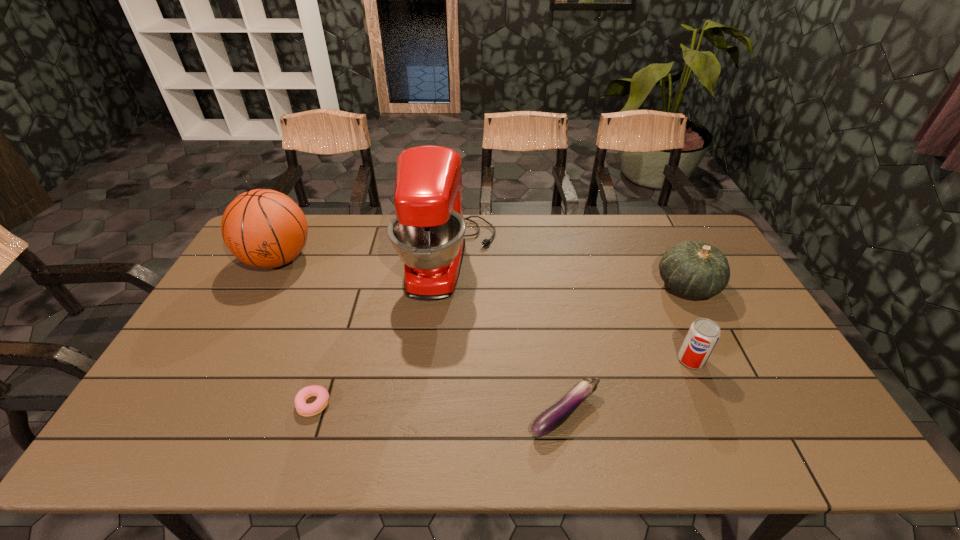
This screenshot has height=540, width=960. Find the location of `free point between the shortest object and the third tallest object`. free point between the shortest object and the third tallest object is located at coordinates (500, 345).

In order to click on vacant region between the second tallest object and the tallest object in this screenshot , I will do `click(364, 260)`.

Where is `vacant area that lies between the gourd and the second shortest object`? vacant area that lies between the gourd and the second shortest object is located at coordinates (626, 349).

You are a GUI agent. You are given a task and a screenshot of the screen. Output one action in this format:
    pyautogui.click(x=<x>, y=<y>)
    Task: Click on the blank region between the second object from left to right and the gourd
    
    Given the screenshot: What is the action you would take?
    pyautogui.click(x=500, y=345)

Where is `empty space that is in between the soda and the third tallest object`? The image size is (960, 540). empty space that is in between the soda and the third tallest object is located at coordinates (689, 323).

This screenshot has width=960, height=540. Find the location of `empty space that is in between the basketball and the tallest object`. empty space that is in between the basketball and the tallest object is located at coordinates (364, 260).

Locate an element on the screen. vacant area that lies between the tallest object and the second shortest object is located at coordinates (507, 337).

Where is `vacant area that lies between the second object from left to right and the eggplant`? The height and width of the screenshot is (540, 960). vacant area that lies between the second object from left to right and the eggplant is located at coordinates (440, 408).

Select which object appears as the fifth closest to the third nearest object. Please provide its 2D coordinates. Your answer should be formatted as a tuple, i.e. [(x, y)], where the tuple contains the x and y coordinates of a point satisfying the conditions above.

[(263, 228)]

Identify the location of object that can be found as the closest to the leftmost object. The width and height of the screenshot is (960, 540). (427, 232).